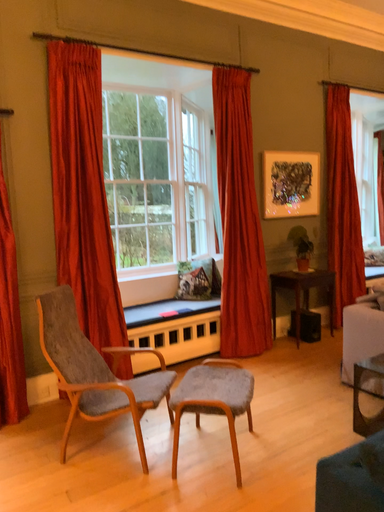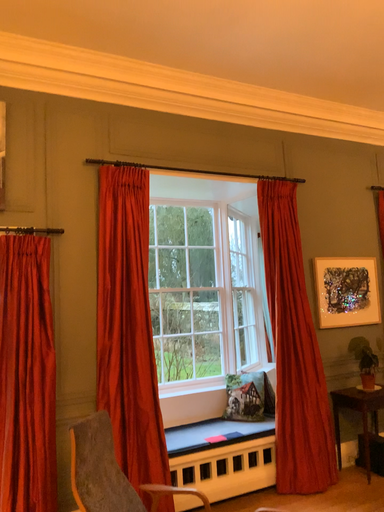
Question: Which way did the camera rotate in the video?

Choices:
 (A) rotated left
 (B) rotated right

Answer: (A)